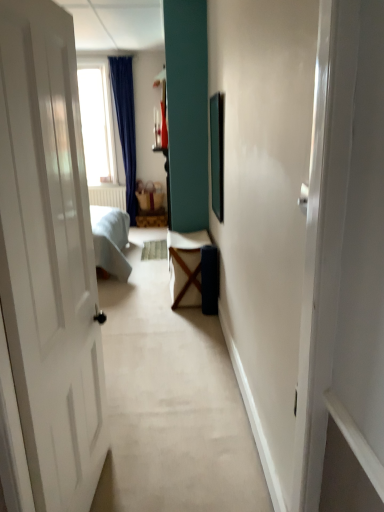
The image size is (384, 512). What do you see at coordinates (186, 266) in the screenshot?
I see `white fabric table at center` at bounding box center [186, 266].

Measure the distance between point (202, 236) and camera.

The distance of point (202, 236) from camera is 14.40 feet.

The image size is (384, 512). Find the location of `white fabric table at center`. white fabric table at center is located at coordinates (186, 266).

From the image's perspective, which object appears higher, matte brown basket at center or metallic silver picture frame at center?

matte brown basket at center is shown above in the image.

From the picture: Is matte brown basket at center situated inside metallic silver picture frame at center or outside?

matte brown basket at center is not enclosed by metallic silver picture frame at center.

Is matte brown basket at center wider or thinner than metallic silver picture frame at center?

matte brown basket at center is wider than metallic silver picture frame at center.

From the picture: Which is nearer, (x=141, y=211) or (x=212, y=128)?

Clearly, point (x=141, y=211) is more distant from the camera than point (x=212, y=128).

Can you confirm if metallic silver picture frame at center is bigger than matte brown basket at center?

Result: No, metallic silver picture frame at center is not bigger than matte brown basket at center.

Is there a large distance between metallic silver picture frame at center and matte brown basket at center?

Absolutely, metallic silver picture frame at center is distant from matte brown basket at center.

Considering the sizes of metallic silver picture frame at center and matte brown basket at center in the image, is metallic silver picture frame at center wider or thinner than matte brown basket at center?

metallic silver picture frame at center is thinner than matte brown basket at center.

From their relative heights in the image, would you say metallic silver picture frame at center is taller or shorter than matte brown basket at center?

Considering their sizes, metallic silver picture frame at center has more height than matte brown basket at center.

Does matte brown basket at center appear on the left side of white fabric table at center?

Yes, matte brown basket at center is to the left of white fabric table at center.

From the image's perspective, relative to white fabric table at center, is matte brown basket at center above or below?

Clearly, from the image's perspective, matte brown basket at center is above white fabric table at center.

Is matte brown basket at center directly adjacent to white fabric table at center?

There is a gap between matte brown basket at center and white fabric table at center.

Which object is closer to the camera taking this photo, matte brown basket at center or white fabric table at center?

Positioned in front is white fabric table at center.

From the image's perspective, which one is positioned lower, white fabric table at center or metallic silver picture frame at center?

white fabric table at center.

Based on the photo, what's the angular difference between white fabric table at center and metallic silver picture frame at center's facing directions?

0.00735 degrees.

Is metallic silver picture frame at center located within white fabric table at center?

Actually, metallic silver picture frame at center is outside white fabric table at center.

Does point (196, 239) come farther from viewer compared to point (213, 105)?

Yes.

Would you say white fabric table at center contains matte brown basket at center?

That's incorrect, matte brown basket at center is not inside white fabric table at center.

Does white fabric table at center appear on the left side of matte brown basket at center?

In fact, white fabric table at center is to the right of matte brown basket at center.

Considering the positions of points (199, 253) and (157, 211), is point (199, 253) farther from camera compared to point (157, 211)?

No.

From the image's perspective, does white fabric table at center appear higher than matte brown basket at center?

No, from the image's perspective, white fabric table at center is not on top of matte brown basket at center.

Is the position of metallic silver picture frame at center less distant than that of white fabric table at center?

Yes, metallic silver picture frame at center is closer to the camera.

From a real-world perspective, is metallic silver picture frame at center on white fabric table at center?

Indeed, from a real-world perspective, metallic silver picture frame at center stands above white fabric table at center.

Considering the sizes of objects metallic silver picture frame at center and white fabric table at center in the image provided, who is smaller, metallic silver picture frame at center or white fabric table at center?

Smaller between the two is metallic silver picture frame at center.

Is metallic silver picture frame at center placed right next to white fabric table at center?

metallic silver picture frame at center is not next to white fabric table at center, and they're not touching.

In order to click on furniture behind the metallic silver picture frame at center in this screenshot , I will do `click(150, 206)`.

You are a GUI agent. You are given a task and a screenshot of the screen. Output one action in this format:
    pyautogui.click(x=<x>, y=<y>)
    Task: Click on the picture frame located above the matte brown basket at center (from a real-world perspective)
    The image size is (384, 512).
    Given the screenshot: What is the action you would take?
    pyautogui.click(x=217, y=153)

When comparing their distances from metallic silver picture frame at center, does matte brown basket at center or white fabric table at center seem further?

matte brown basket at center is further to metallic silver picture frame at center.

When comparing their distances from matte brown basket at center, does metallic silver picture frame at center or white fabric table at center seem closer?

metallic silver picture frame at center.

Estimate the real-world distances between objects in this image. Which object is closer to white fabric table at center, metallic silver picture frame at center or matte brown basket at center?

metallic silver picture frame at center is positioned closer to the anchor white fabric table at center.

Based on the photo, when comparing their distances from metallic silver picture frame at center, does white fabric table at center or matte brown basket at center seem further?

Based on the image, matte brown basket at center appears to be further to metallic silver picture frame at center.

From the image, which object appears to be nearer to matte brown basket at center, white fabric table at center or metallic silver picture frame at center?

The object closer to matte brown basket at center is metallic silver picture frame at center.

When comparing their distances from white fabric table at center, does matte brown basket at center or metallic silver picture frame at center seem further?

Based on the image, matte brown basket at center appears to be further to white fabric table at center.

I want to click on table between metallic silver picture frame at center and matte brown basket at center along the z-axis, so click(x=186, y=266).